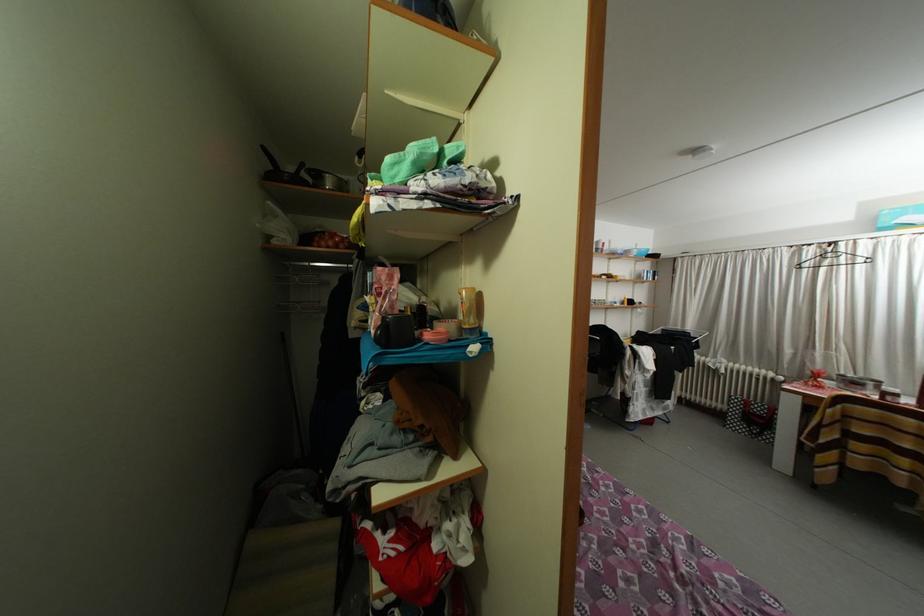
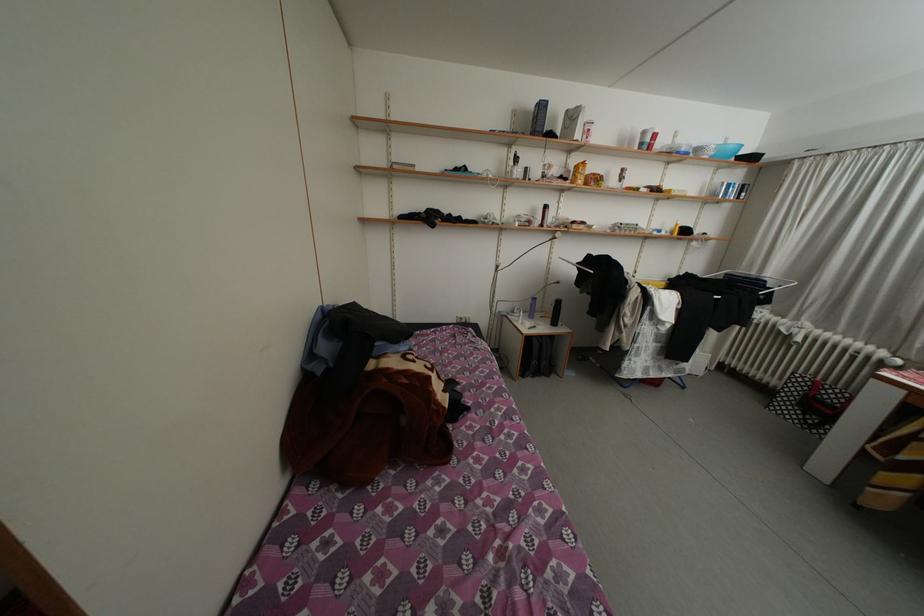
The point at (604, 254) is marked in the first image. Where is the corresponding point in the second image?

(650, 148)